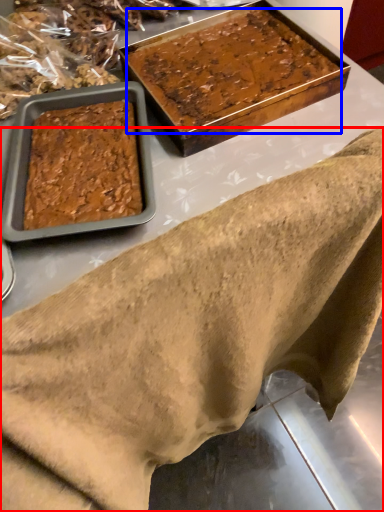
Question: Which object appears farthest to the camera in this image, wrap (highlighted by a red box) or dessert (highlighted by a blue box)?

Choices:
 (A) wrap
 (B) dessert

Answer: (B)